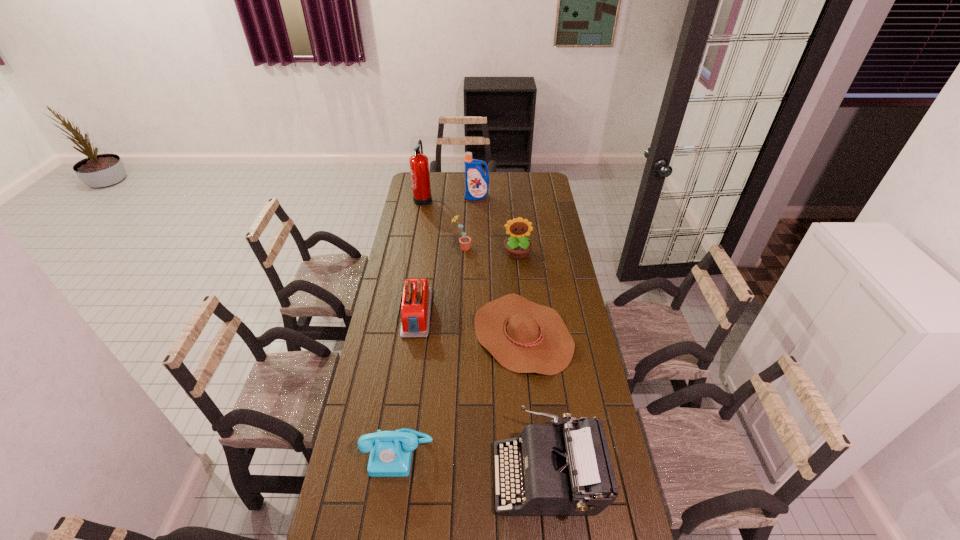
The height and width of the screenshot is (540, 960). What are the coordinates of `toaster that is positioned at the left edge` in the screenshot? It's located at (416, 304).

Where is `telephone that is at the left edge`? telephone that is at the left edge is located at coordinates (390, 451).

Identify the location of typewriter positioned at the right edge. The image size is (960, 540). (571, 473).

This screenshot has height=540, width=960. What are the coordinates of `cowboy hat present at the right edge` in the screenshot? It's located at (524, 337).

Identify the location of object present at the far left corner. (419, 166).

In order to click on free space at the far edge in this screenshot , I will do `click(499, 187)`.

The height and width of the screenshot is (540, 960). Find the location of `free space at the left edge`. free space at the left edge is located at coordinates (398, 251).

What are the coordinates of `free space at the right edge of the desktop` in the screenshot? It's located at (537, 198).

I want to click on free space between the right sunflower and the cowboy hat, so click(520, 294).

Find the location of `vacant area that lies between the cowboy hat and the toaster`. vacant area that lies between the cowboy hat and the toaster is located at coordinates (469, 323).